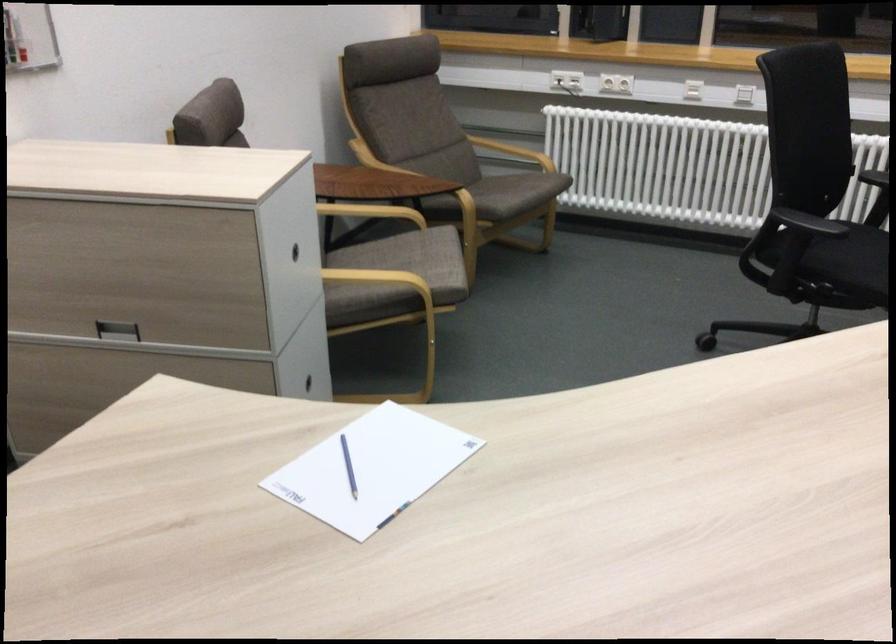
Identify the location of black chair sitting surface. This screenshot has width=896, height=644. (849, 267).